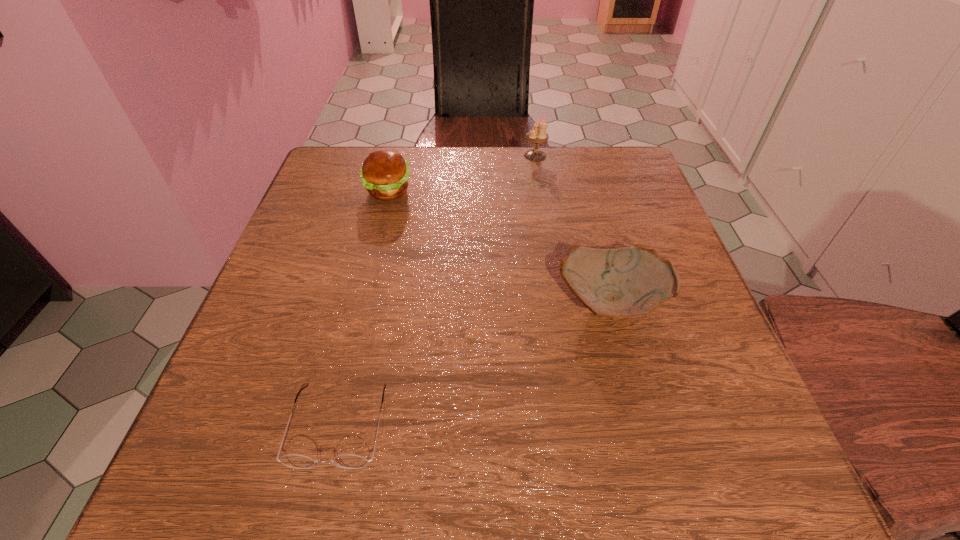
Find the location of a particular element. Image resolution: width=960 pixels, height=540 pixels. the farthest object is located at coordinates (538, 134).

This screenshot has height=540, width=960. What are the coordinates of `the tallest object` in the screenshot? It's located at (538, 134).

The height and width of the screenshot is (540, 960). In order to click on hamburger in this screenshot , I will do `click(384, 173)`.

At what (x,y) coordinates should I click in order to perform the action: click on the third shortest object. Please return your answer as a coordinate pair (x, y). The height and width of the screenshot is (540, 960). Looking at the image, I should click on (384, 173).

Find the location of a particular element. The height and width of the screenshot is (540, 960). the third tallest object is located at coordinates (629, 282).

I want to click on pottery, so click(x=629, y=282).

Find the location of a particular element. The width and height of the screenshot is (960, 540). the nearest object is located at coordinates (347, 461).

Find the location of a particular element. The image size is (960, 540). the shortest object is located at coordinates (347, 461).

Find the location of a particular element. This screenshot has width=960, height=540. vacant space located on the front of the farthest object is located at coordinates (543, 204).

The height and width of the screenshot is (540, 960). In order to click on vacant region located on the right of the hamburger in this screenshot , I will do `click(506, 191)`.